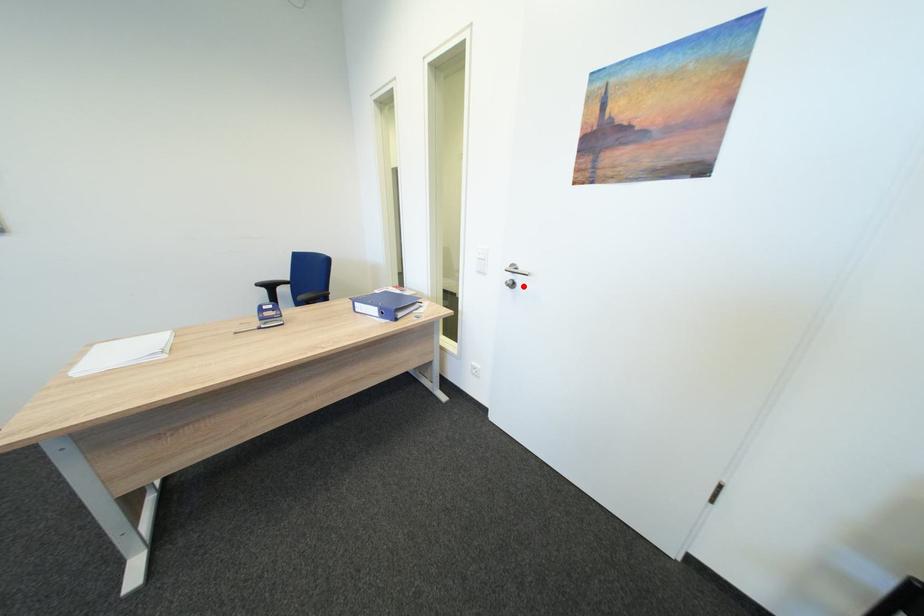
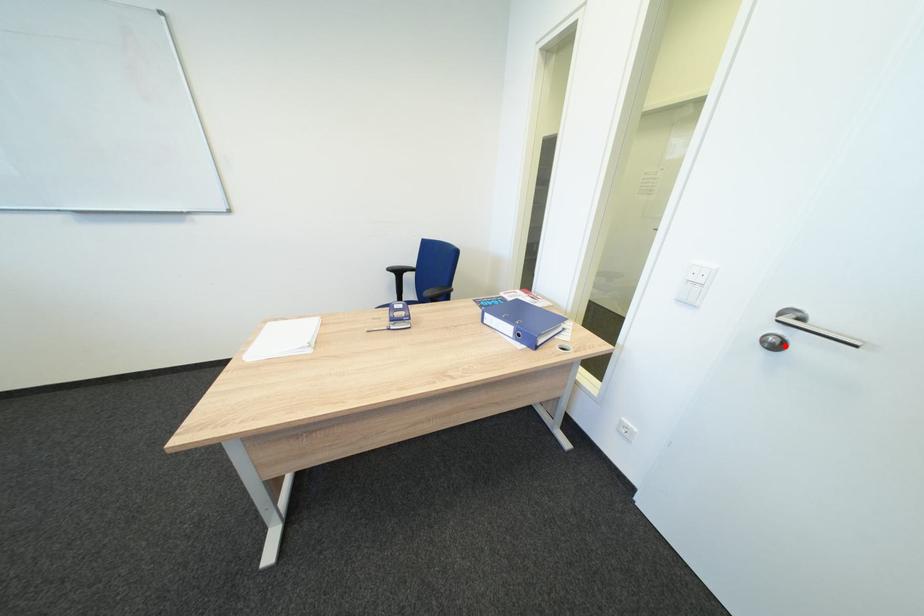
Looking at this image, I am providing you with two images of the same scene from different viewpoints. A red point is marked on the first image and another point is marked on the second image. Is the marked point in image1 the same physical position as the marked point in image2?

Yes